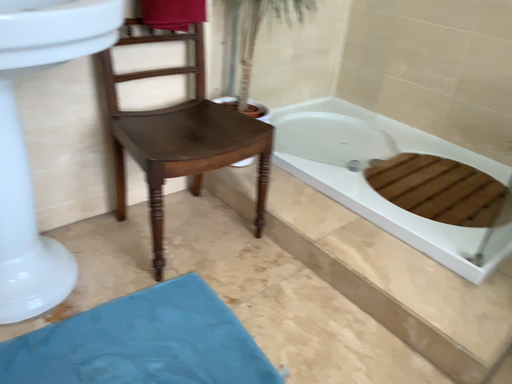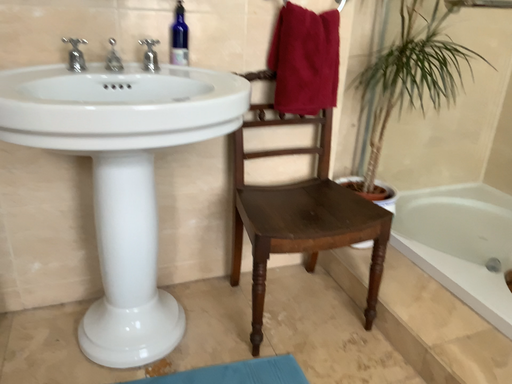
Question: Which way did the camera rotate in the video?

Choices:
 (A) rotated left
 (B) rotated right

Answer: (A)